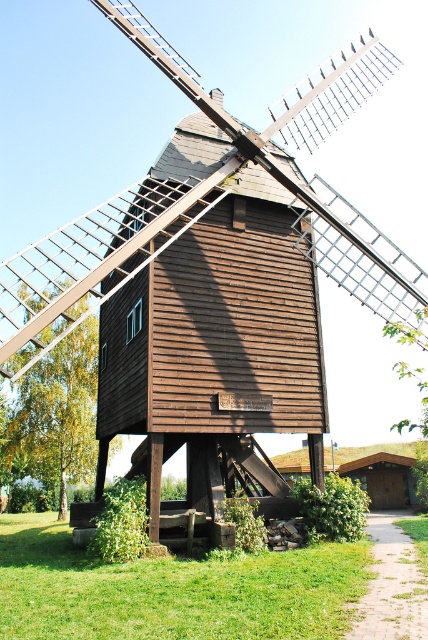
You are a drone operator tasked with capturing aerial footage of the brown wooden hut at center and the brown wooden hut at lower right. Your drone has a maximum flight range of 20 meters. Can you fly the drone from one to the other without exceeding its range?

The brown wooden hut at center and brown wooden hut at lower right are 20.71 meters apart from each other, which exceeds the drone flight range of 20 meters. Therefore, the drone cannot safely fly between them without exceeding its range.

You are planning to build a fence around the brown wooden hut at center and the brown wooden windmill at center. Which structure requires a wider fence to accommodate its width?

The brown wooden windmill at center requires a wider fence because its width is greater than the brown wooden hut at center.